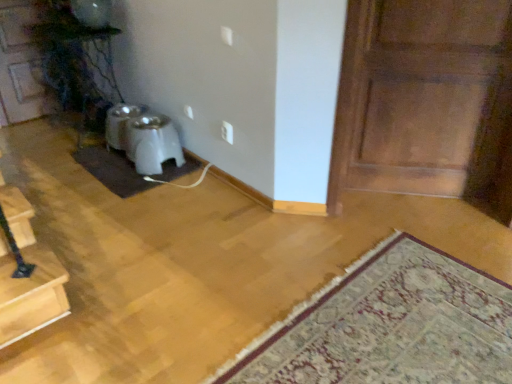
You are a GUI agent. You are given a task and a screenshot of the screen. Output one action in this format:
    pyautogui.click(x=<x>, y=<y>)
    Task: Click on the free space to the back side of carpeted rug at lower right
    
    Given the screenshot: What is the action you would take?
    pyautogui.click(x=336, y=230)